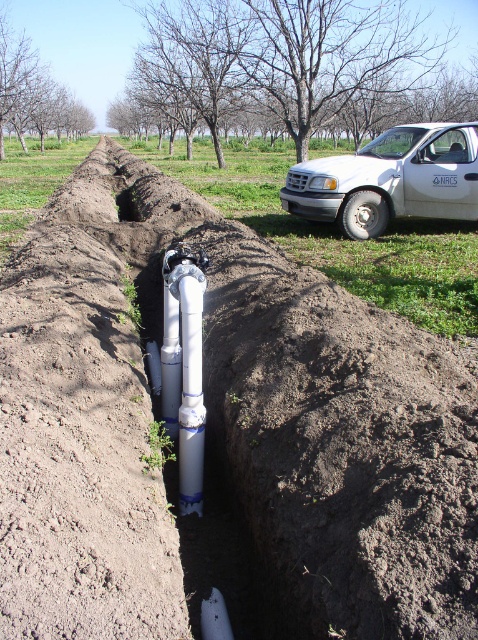
Question: Which point appears closest to the camera in this image?

Choices:
 (A) (471, 145)
 (B) (191, 385)
 (C) (134, 220)

Answer: (B)

Question: Considering the relative positions of white matte truck at upper right and smooth concrete hole at center in the image provided, where is white matte truck at upper right located with respect to smooth concrete hole at center?

Choices:
 (A) above
 (B) below

Answer: (A)

Question: Which point is farther from the camera taking this photo?

Choices:
 (A) (180, 355)
 (B) (131, 195)
 (C) (352, 221)

Answer: (B)

Question: Observing the image, what is the correct spatial positioning of white plastic water pipe at center in reference to smooth concrete hole at center?

Choices:
 (A) right
 (B) left

Answer: (A)

Question: Which point appears closest to the camera in this image?

Choices:
 (A) (188, 388)
 (B) (126, 202)

Answer: (A)

Question: Does white matte truck at upper right appear on the right side of smooth concrete hole at center?

Choices:
 (A) no
 (B) yes

Answer: (B)